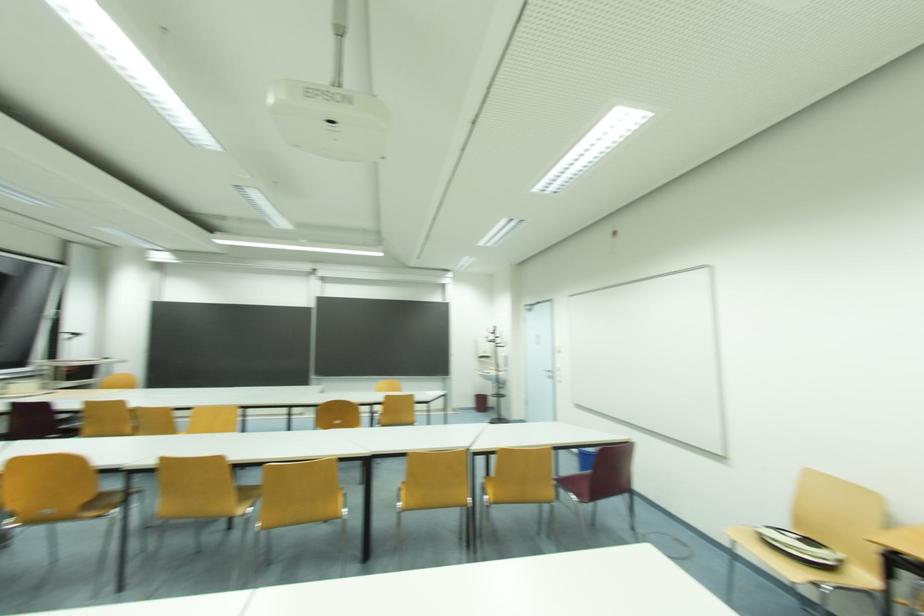
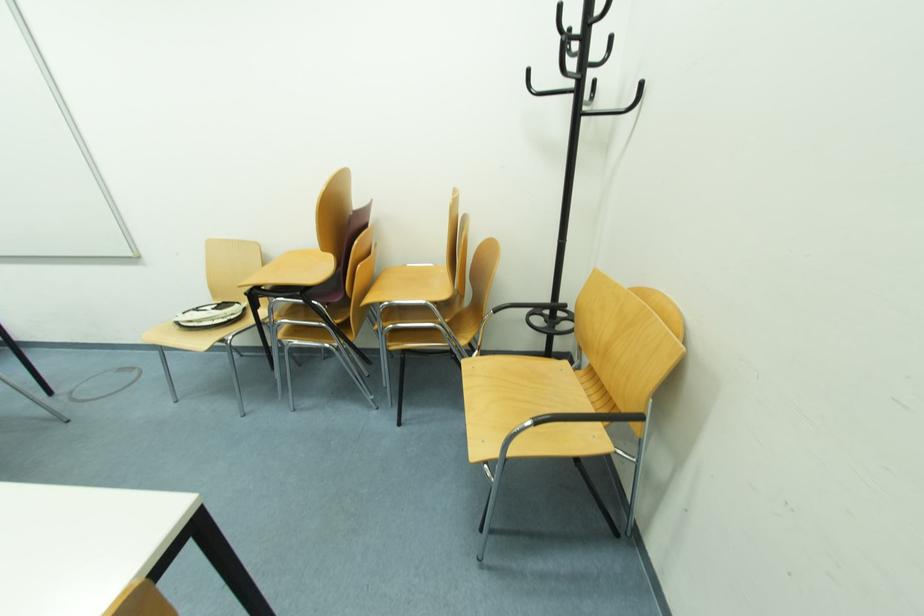
First-person continuous shooting, in which direction is the camera rotating?

The camera's rotation is toward right-down.